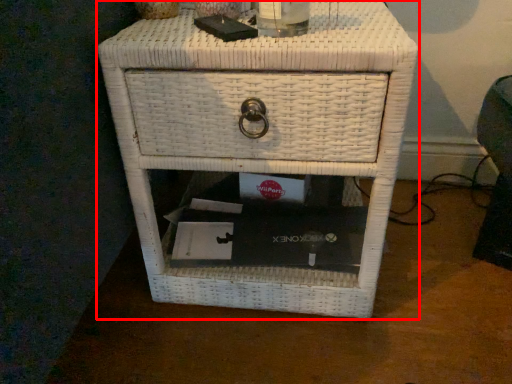
Question: Observing the image, what is the correct spatial positioning of nightstand (annotated by the red box) in reference to beverage?

Choices:
 (A) right
 (B) left

Answer: (B)